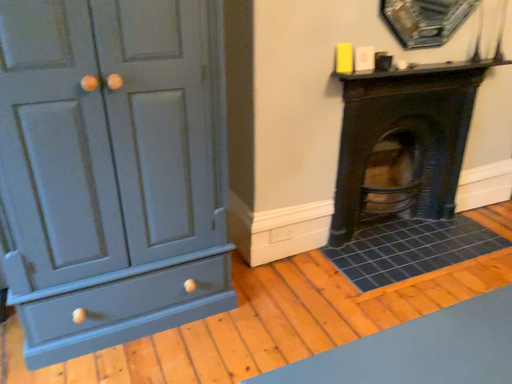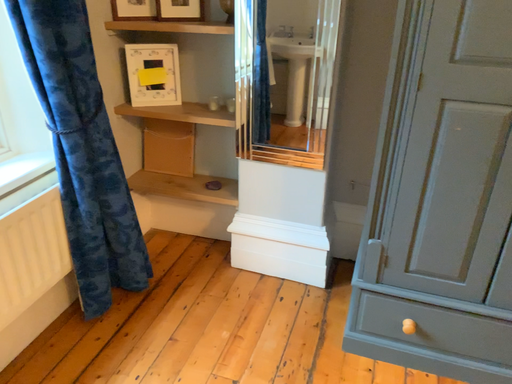
Question: How did the camera likely rotate when shooting the video?

Choices:
 (A) rotated upward
 (B) rotated downward

Answer: (A)